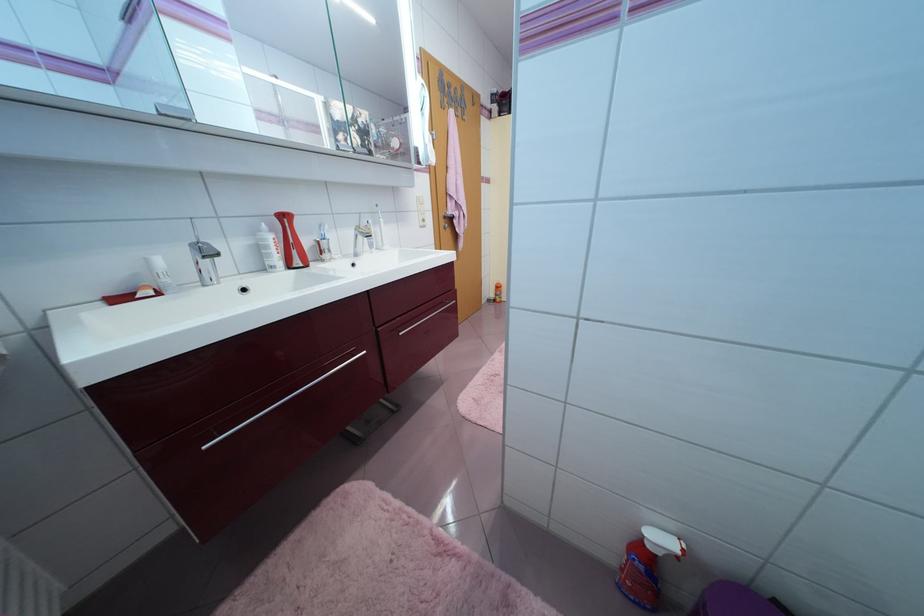
This screenshot has width=924, height=616. What do you see at coordinates (388, 134) in the screenshot?
I see `the mirror cabinet handle` at bounding box center [388, 134].